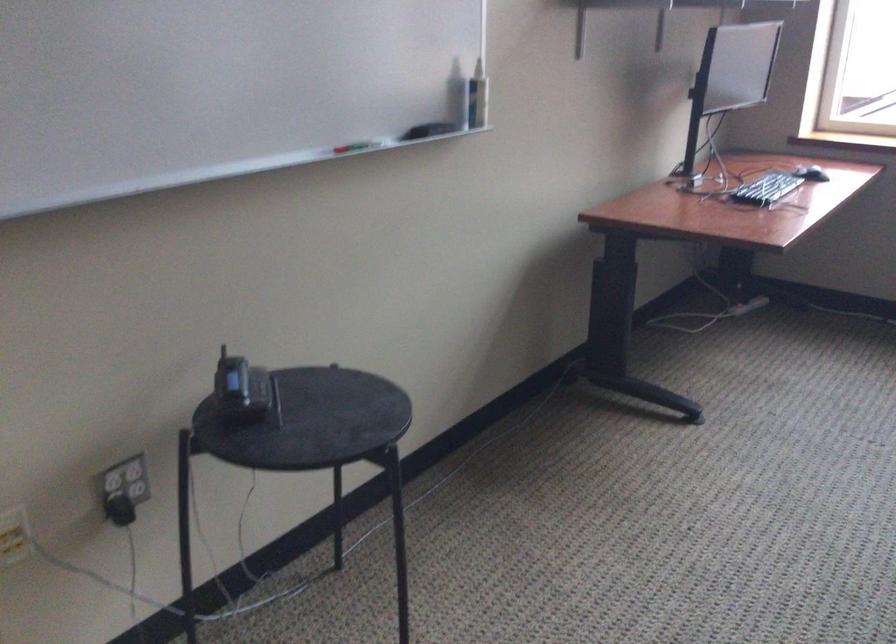
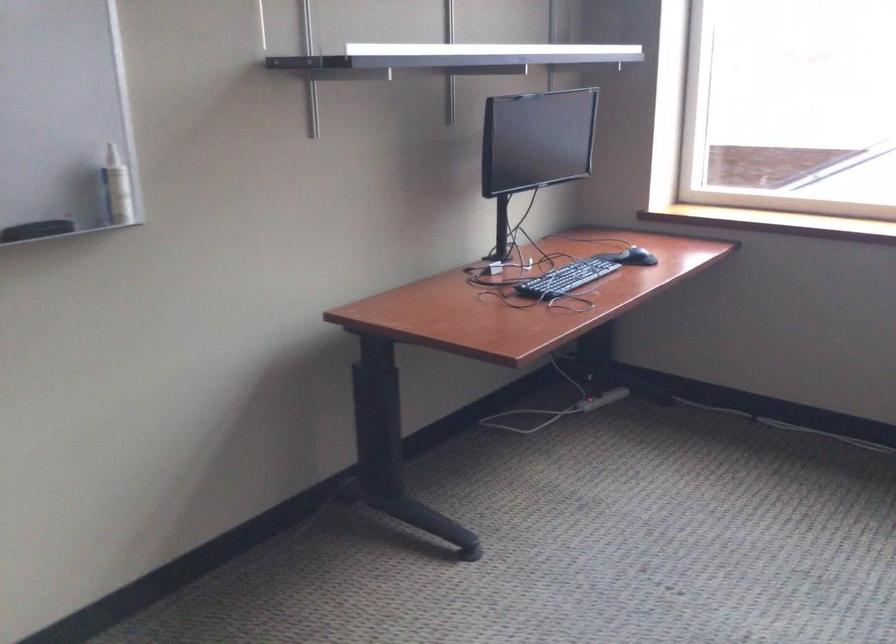
In the second image, find the point that corresponds to pixel 467 100 in the first image.

(117, 187)